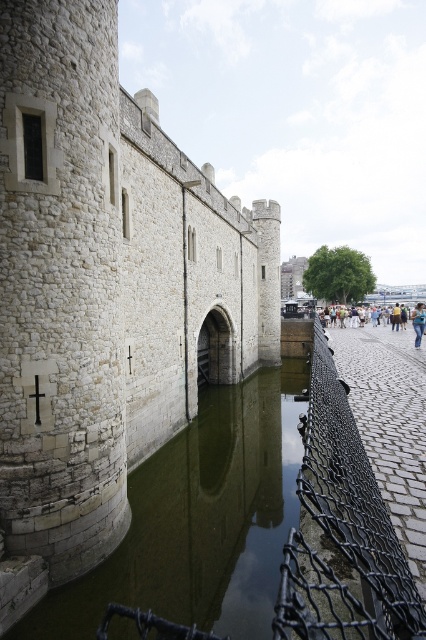
You are standing at the edge of the moat looking towards the Tower of London. There is a point marked at coordinates point (104, 291). Based on the scene description, what object or structure does this coordinate point likely correspond to?

The point (104, 291) corresponds to the white stone castle at center.